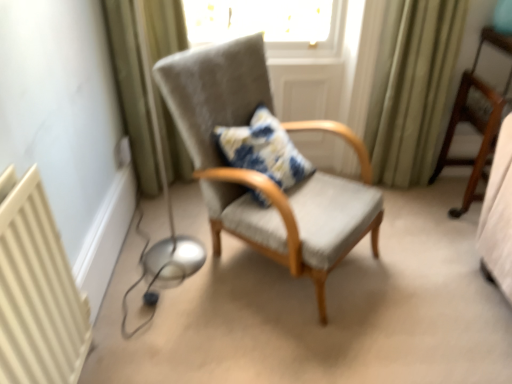
Question: Is green fabric curtain at left, which ranks as the 2th curtain in right-to-left order, closer to camera compared to white plastic electric outlet at lower left?

Choices:
 (A) no
 (B) yes

Answer: (B)

Question: From the image's perspective, is green fabric curtain at left, which ranks as the 2th curtain in right-to-left order, below white plastic electric outlet at lower left?

Choices:
 (A) no
 (B) yes

Answer: (A)

Question: Can you see green fabric curtain at left, which ranks as the 2th curtain in right-to-left order, touching white plastic electric outlet at lower left?

Choices:
 (A) no
 (B) yes

Answer: (A)

Question: From a real-world perspective, is green fabric curtain at left, which ranks as the 2th curtain in right-to-left order, on top of white plastic electric outlet at lower left?

Choices:
 (A) yes
 (B) no

Answer: (A)

Question: Considering the relative sizes of green fabric curtain at left, which ranks as the 2th curtain in right-to-left order, and white plastic electric outlet at lower left in the image provided, is green fabric curtain at left, which ranks as the 2th curtain in right-to-left order, wider than white plastic electric outlet at lower left?

Choices:
 (A) yes
 (B) no

Answer: (A)

Question: From the image's perspective, is white plastic electric outlet at lower left positioned above or below green fabric curtain at right, which is the second curtain from left to right?

Choices:
 (A) above
 (B) below

Answer: (B)

Question: Is white plastic electric outlet at lower left wider or thinner than green fabric curtain at right, which is the 1th curtain in right-to-left order?

Choices:
 (A) thin
 (B) wide

Answer: (A)

Question: Considering the positions of white plastic electric outlet at lower left and green fabric curtain at right, which is the 1th curtain in right-to-left order, in the image, is white plastic electric outlet at lower left bigger or smaller than green fabric curtain at right, which is the 1th curtain in right-to-left order,?

Choices:
 (A) big
 (B) small

Answer: (B)

Question: Would you say white plastic electric outlet at lower left is inside or outside green fabric curtain at right, which is the second curtain from left to right?

Choices:
 (A) outside
 (B) inside

Answer: (A)

Question: Is point (388, 13) positioned closer to the camera than point (121, 11)?

Choices:
 (A) closer
 (B) farther

Answer: (B)

Question: Considering the positions of green fabric curtain at right, which is the 1th curtain in right-to-left order, and green fabric curtain at left, which ranks as the 2th curtain in right-to-left order, in the image, is green fabric curtain at right, which is the 1th curtain in right-to-left order, taller or shorter than green fabric curtain at left, which ranks as the 2th curtain in right-to-left order,?

Choices:
 (A) short
 (B) tall

Answer: (A)

Question: Visually, is green fabric curtain at right, which is the 1th curtain in right-to-left order, positioned to the left or to the right of green fabric curtain at left, which ranks as the 2th curtain in right-to-left order?

Choices:
 (A) right
 (B) left

Answer: (A)

Question: Considering the positions of green fabric curtain at right, which is the 1th curtain in right-to-left order, and green fabric curtain at left, which ranks as the 2th curtain in right-to-left order, in the image, is green fabric curtain at right, which is the 1th curtain in right-to-left order, bigger or smaller than green fabric curtain at left, which ranks as the 2th curtain in right-to-left order,?

Choices:
 (A) small
 (B) big

Answer: (A)

Question: In the image, is wooden chair at right, which is the 2th chair in left-to-right order, positioned in front of or behind textured gray armchair at center, marked as the 1th chair in a left-to-right arrangement?

Choices:
 (A) behind
 (B) front

Answer: (A)

Question: From the image's perspective, relative to textured gray armchair at center, the second chair viewed from the right, is wooden chair at right, which is the 2th chair in left-to-right order, above or below?

Choices:
 (A) below
 (B) above

Answer: (B)